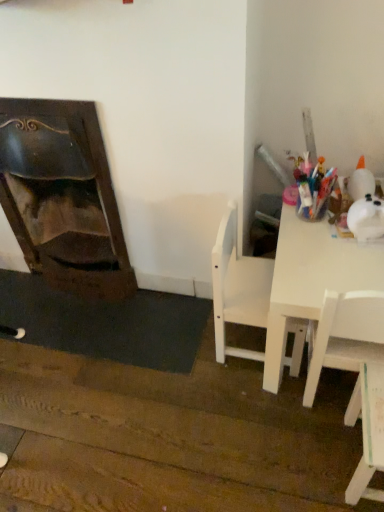
You are a GUI agent. You are given a task and a screenshot of the screen. Output one action in this format:
    pyautogui.click(x=<x>, y=<y>)
    Task: Click on the free spot below white matte chair at lower right, positioned as the 2th chair in left-to-right order (from a real-world perspective)
    The height and width of the screenshot is (512, 384).
    Given the screenshot: What is the action you would take?
    pyautogui.click(x=352, y=459)